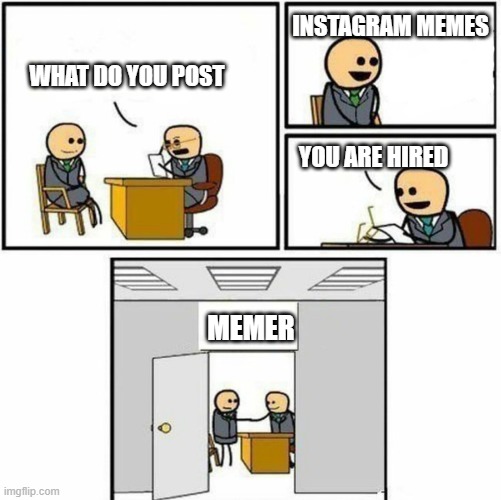
The height and width of the screenshot is (500, 501). In order to click on ceiling light in this screenshot , I will do `click(139, 281)`, `click(245, 278)`, `click(344, 280)`.